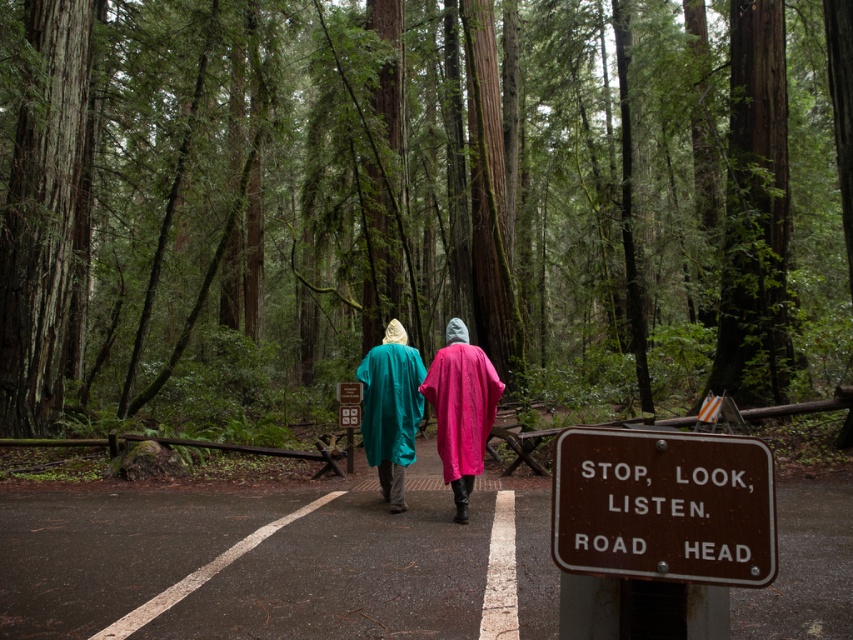
You are standing at the starting point in the forest and see two points marked in the image. Which point is closer to you, point (474, 444) or point (483, 420)?

Point (474, 444) is in front of point (483, 420), so it is closer to you.

You are standing at the center of the forest scene. There is a point marked at coordinates (461, 410). What object is located at this point?

The point at coordinates (461, 410) corresponds to the teal matte poncho at center.

You are a photographer trying to capture both the teal matte poncho at center and the pink fabric robe at center in the same frame. Based on their positions, which one is closer to the camera?

The teal matte poncho at center is closer to the camera because it is in front of the pink fabric robe at center.